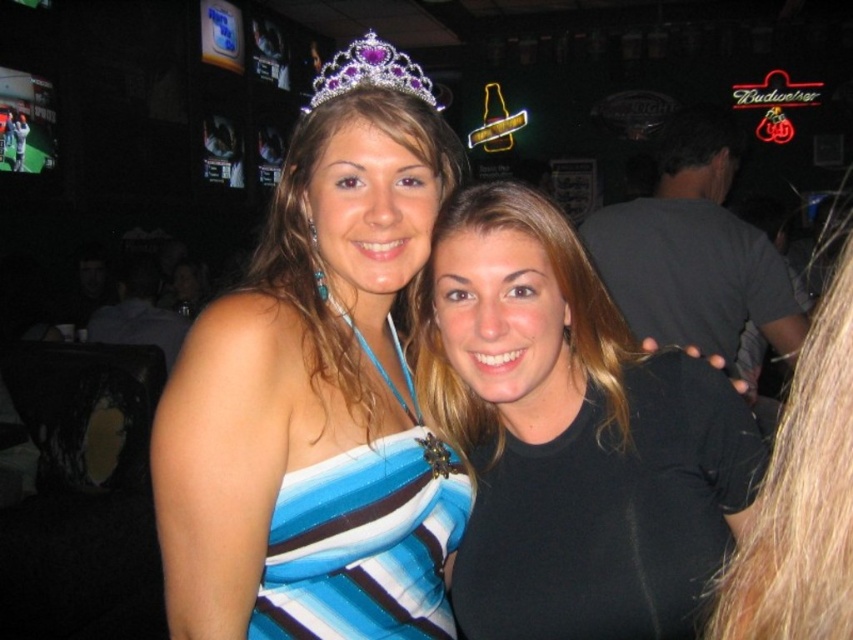
Between black matte shirt at center and blue striped fabric dress at center, which one is positioned higher?

black matte shirt at center is above.

Locate an element on the screen. The height and width of the screenshot is (640, 853). black matte shirt at center is located at coordinates (572, 436).

Between point (575, 349) and point (396, 445), which one is positioned in front?

Point (396, 445) is more forward.

Locate an element on the screen. black matte shirt at center is located at coordinates (572, 436).

Is blue satin dress at center to the left of black matte shirt at center from the viewer's perspective?

Indeed, blue satin dress at center is positioned on the left side of black matte shirt at center.

Who is positioned more to the left, blue satin dress at center or black matte shirt at center?

blue satin dress at center

You are a GUI agent. You are given a task and a screenshot of the screen. Output one action in this format:
    pyautogui.click(x=<x>, y=<y>)
    Task: Click on the blue satin dress at center
    Image resolution: width=853 pixels, height=640 pixels.
    Given the screenshot: What is the action you would take?
    pyautogui.click(x=316, y=404)

The width and height of the screenshot is (853, 640). What are the coordinates of `blue satin dress at center` in the screenshot? It's located at (316, 404).

Is blue satin dress at center to the right of blue striped fabric dress at center from the viewer's perspective?

No, blue satin dress at center is not to the right of blue striped fabric dress at center.

Describe the element at coordinates (316, 404) in the screenshot. This screenshot has height=640, width=853. I see `blue satin dress at center` at that location.

I want to click on blue satin dress at center, so click(316, 404).